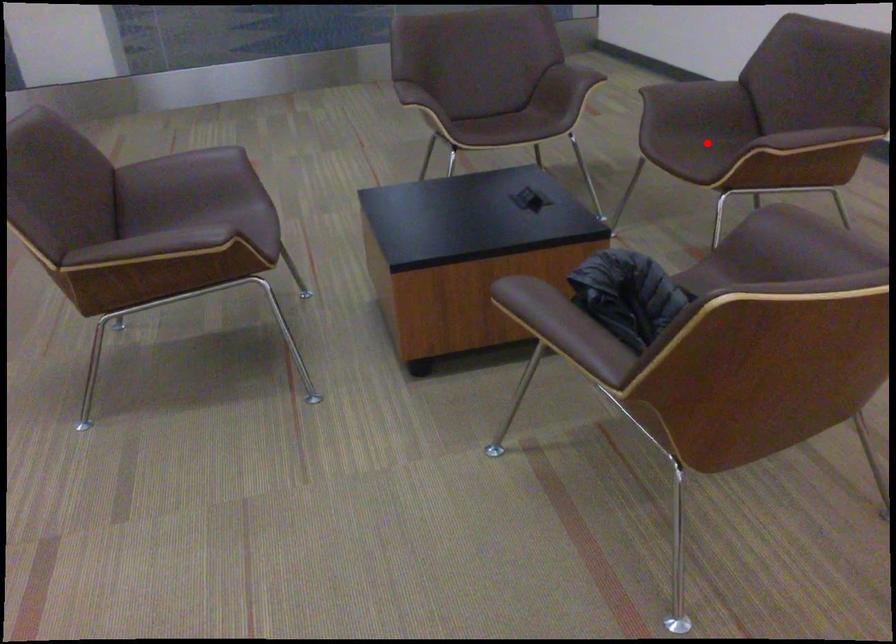
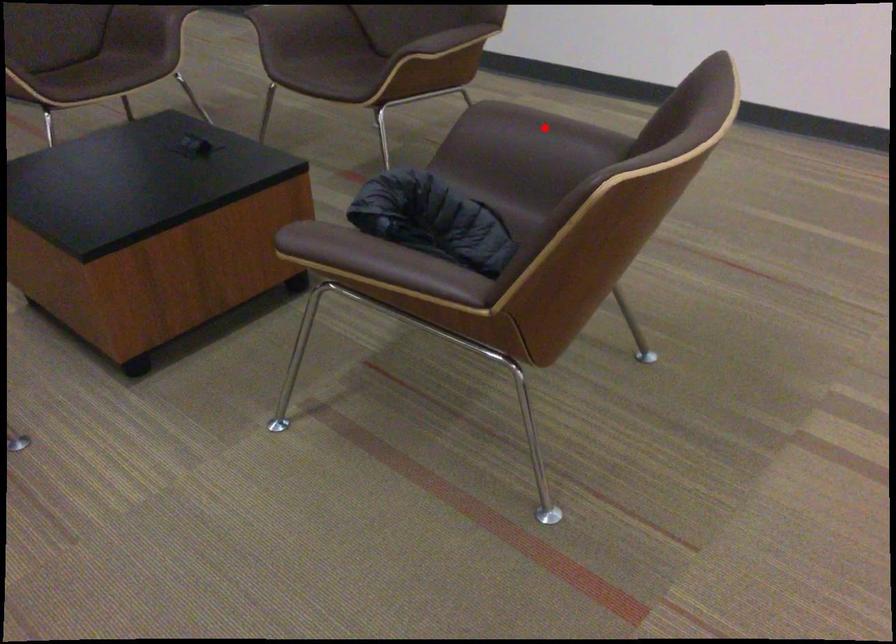
I am providing you with two images of the same scene from different viewpoints. A red point is marked on the first image and another point is marked on the second image. Are the points marked in image1 and image2 representing the same 3D position?

No